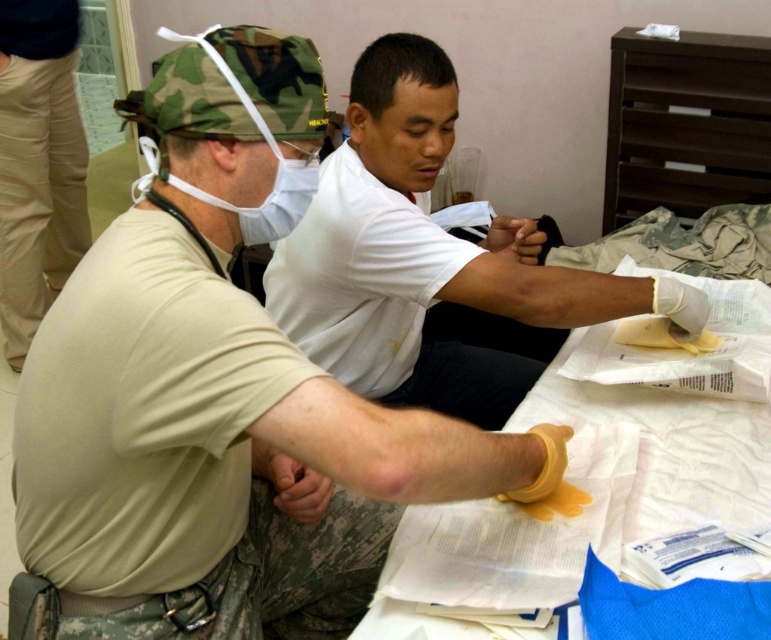
Question: Which object appears closest to the camera in this image?

Choices:
 (A) tan cotton pants at lower left
 (B) yellow rubber glove at lower center

Answer: (B)

Question: Which point is farther from the camera taking this photo?

Choices:
 (A) (214, 621)
 (B) (62, 77)

Answer: (B)

Question: Can you confirm if yellow rubber glove at lower center is bigger than tan cotton pants at lower left?

Choices:
 (A) yes
 (B) no

Answer: (A)

Question: From the image, what is the correct spatial relationship of yellow rubber glove at lower center in relation to tan cotton pants at lower left?

Choices:
 (A) right
 (B) left

Answer: (A)

Question: Can you confirm if yellow rubber glove at lower center is positioned to the right of tan cotton pants at lower left?

Choices:
 (A) no
 (B) yes

Answer: (B)